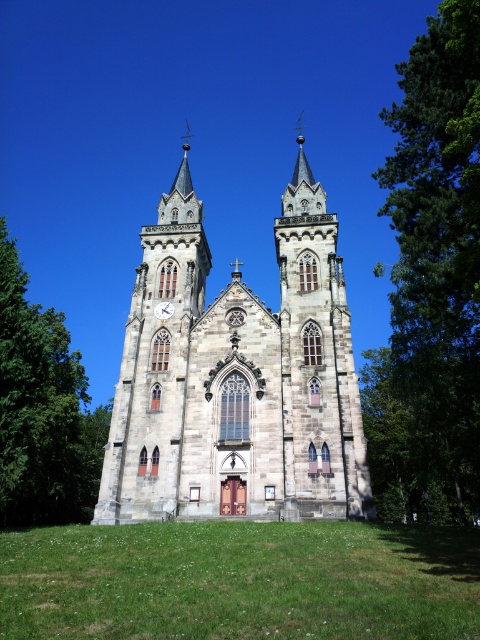
Is green leafy tree at lower left shorter than white matte clock at center?

In fact, green leafy tree at lower left may be taller than white matte clock at center.

Who is more forward, (12, 336) or (170, 312)?

Point (12, 336) is in front.

Identify the location of green leafy tree at lower left. (43, 410).

You are a GUI agent. You are given a task and a screenshot of the screen. Output one action in this format:
    pyautogui.click(x=<x>, y=<y>)
    Task: Click on the green leafy tree at lower left
    The image size is (480, 640).
    Given the screenshot: What is the action you would take?
    pyautogui.click(x=43, y=410)

Is the position of green grass at lower center more distant than that of green leafy tree at lower left?

No, it is in front of green leafy tree at lower left.

Which is behind, point (415, 632) or point (72, 352)?

The point (72, 352) is behind.

At what (x,y) coordinates should I click in order to perform the action: click on green grass at lower center. Please return your answer as a coordinate pair (x, y). This screenshot has height=640, width=480. Looking at the image, I should click on (240, 580).

Is brown stone church at center positioned before white matte clock at center?

Yes, it is in front of white matte clock at center.

Between point (343, 433) and point (168, 316), which one is positioned in front?

Positioned in front is point (343, 433).

Is point (297, 396) farther from camera compared to point (156, 312)?

No, it is in front of (156, 312).

Find the location of a particular element. brown stone church at center is located at coordinates (237, 378).